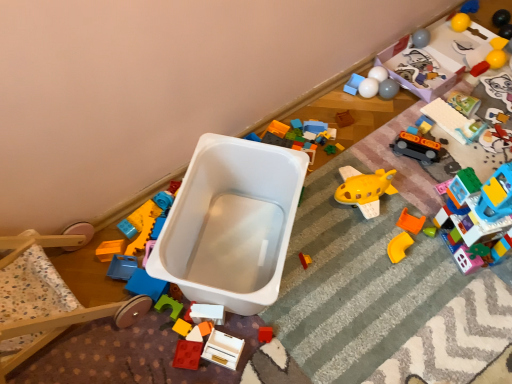
I want to click on free space in front of rubberized plastic block at center, the sixteenth toy from the right, so click(x=177, y=364).